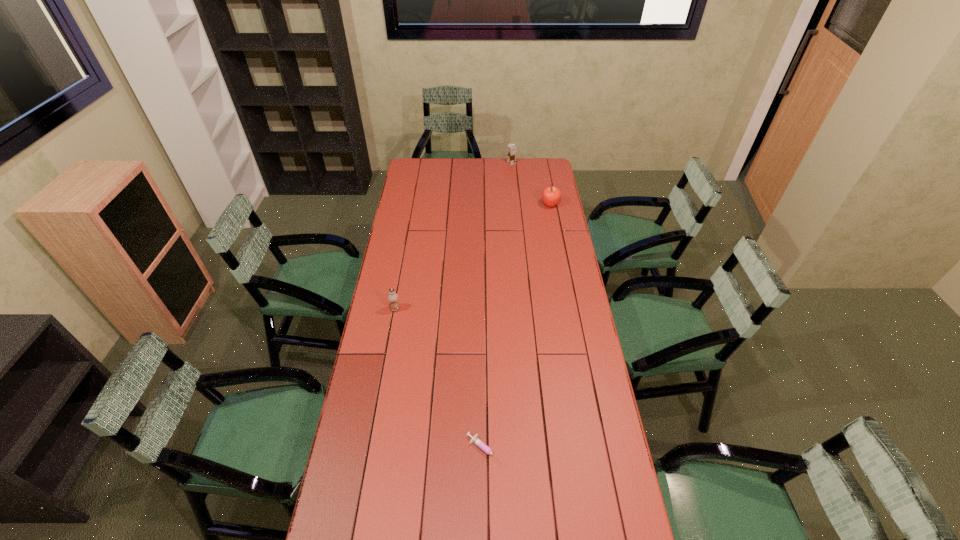
At what (x,y) coordinates should I click in order to perform the action: click on free spot that satisfies the following two spatial constraints: 1. on the back side of the farthest object; 2. on the left side of the second object from left to right. Please return your answer as a coordinate pair (x, y). This screenshot has width=960, height=540. Looking at the image, I should click on (483, 163).